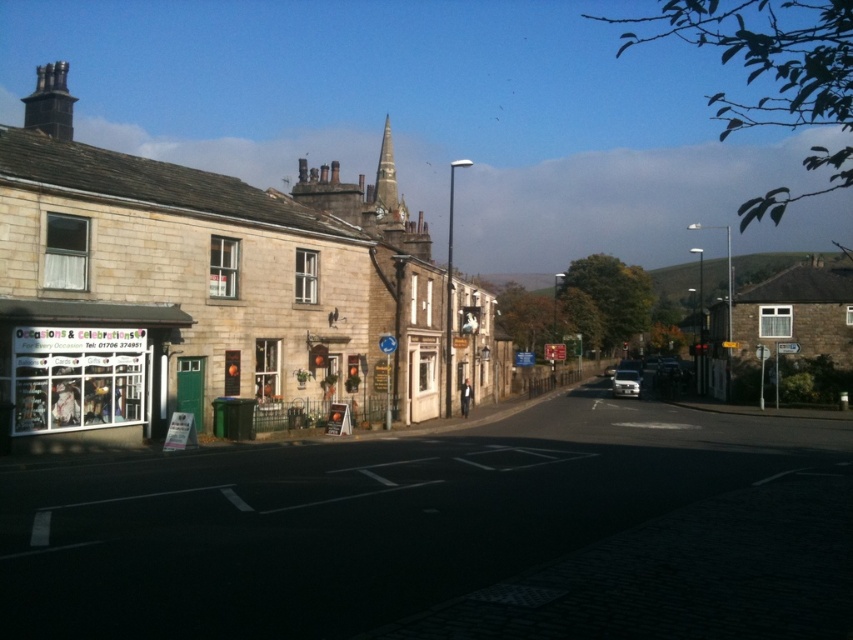
Is matte glass window at left to the right of smooth stone spire at center from the viewer's perspective?

Incorrect, matte glass window at left is not on the right side of smooth stone spire at center.

Is point (171, 312) positioned after point (392, 188)?

No, (171, 312) is in front of (392, 188).

Where is `matte glass window at left`? matte glass window at left is located at coordinates (83, 368).

Does stone building at left appear on the right side of smooth stone spire at center?

Yes, stone building at left is to the right of smooth stone spire at center.

Who is more distant from viewer, (450,305) or (404,214)?

The point (404,214) is more distant.

You are a GUI agent. You are given a task and a screenshot of the screen. Output one action in this format:
    pyautogui.click(x=<x>, y=<y>)
    Task: Click on the stone building at left
    
    Given the screenshot: What is the action you would take?
    pyautogui.click(x=213, y=292)

Looking at this image, is matte glass window at left smaller than white glossy car at center-right?

No, matte glass window at left is not smaller than white glossy car at center-right.

Is point (76, 307) in front of point (613, 376)?

Yes, point (76, 307) is closer to viewer.

Locate an element on the screen. matte glass window at left is located at coordinates (83, 368).